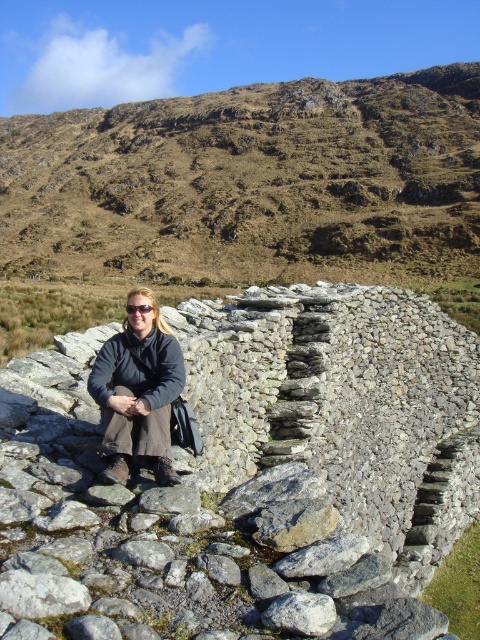
In the scene shown: You are planning to build a small garden on the gray rough stone wall at center and the brown grassy hillside at upper center. Which location has enough space to accommodate a wider garden bed?

The brown grassy hillside at upper center has a greater width than the gray rough stone wall at center, so it can accommodate a wider garden bed.

You are a hiker who wants to sit on the gray rough stone wall at center. However, you are wearing a matte black coat at center. Is there enough space between your coat and the wall to sit comfortably?

The gray rough stone wall at center is located above the matte black coat at center, so there is vertical space between them. However, the description does not provide information about horizontal space needed for sitting comfortably, so it is uncertain.

You are a hiker who wants to take a photo of the gray rough stone wall at center and the matte black coat at center. Since you want to ensure both are fully visible in the frame, which object should you focus on first to make sure it fits in the photo?

The gray rough stone wall at center is taller than the matte black coat at center, so you should focus on ensuring the gray rough stone wall at center fits first as it is taller and might require more space vertically.